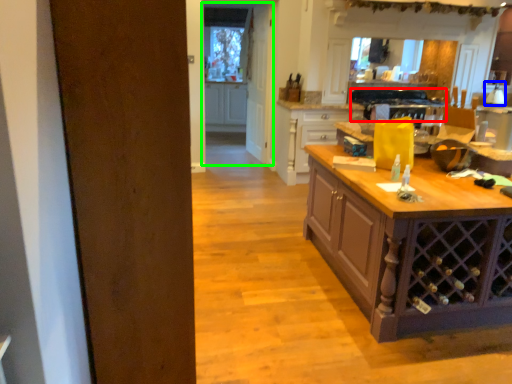
Question: Based on their relative distances, which object is farther from oven (highlighted by a red box)? Choose from kitchen appliance (highlighted by a blue box) and glass door (highlighted by a green box).

Choices:
 (A) kitchen appliance
 (B) glass door

Answer: (B)